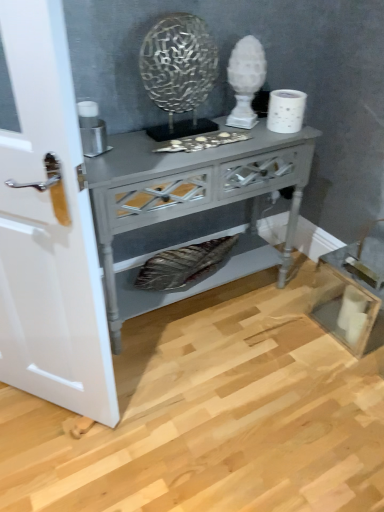
Identify the location of vacant point to the right of matte gray wooden nightstand at center. (292, 335).